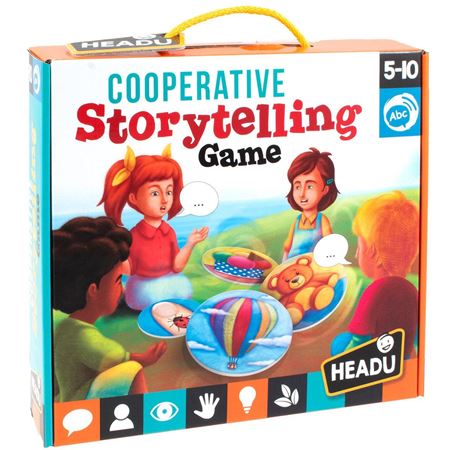
Where is `plate`? This screenshot has width=450, height=450. plate is located at coordinates (197, 326), (146, 321), (209, 256), (327, 308).